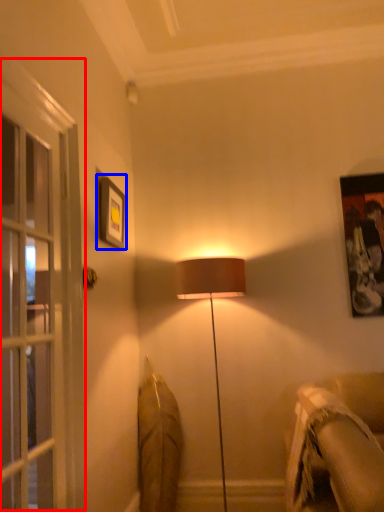
Question: Which point is closer to the camera, screen door (highlighted by a red box) or picture frame (highlighted by a blue box)?

Choices:
 (A) screen door
 (B) picture frame

Answer: (A)